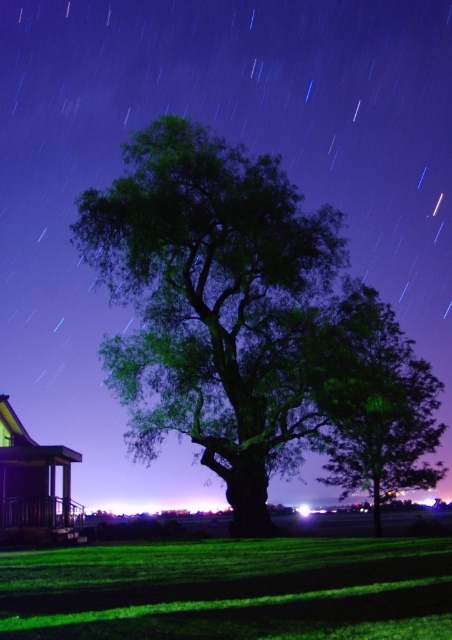
Question: Does green leafy oak tree at center have a larger size compared to green leafy tree at center?

Choices:
 (A) yes
 (B) no

Answer: (A)

Question: Does green leafy oak tree at center appear under green leafy tree at center?

Choices:
 (A) yes
 (B) no

Answer: (B)

Question: Does green leafy oak tree at center have a greater width compared to green leafy tree at center?

Choices:
 (A) no
 (B) yes

Answer: (B)

Question: Among these objects, which one is farthest from the camera?

Choices:
 (A) green leafy oak tree at center
 (B) green leafy tree at center

Answer: (A)

Question: Which point appears closest to the camera in this image?

Choices:
 (A) [x=401, y=333]
 (B) [x=126, y=256]

Answer: (B)

Question: Which point is closer to the camera?

Choices:
 (A) (150, 212)
 (B) (414, 476)

Answer: (A)